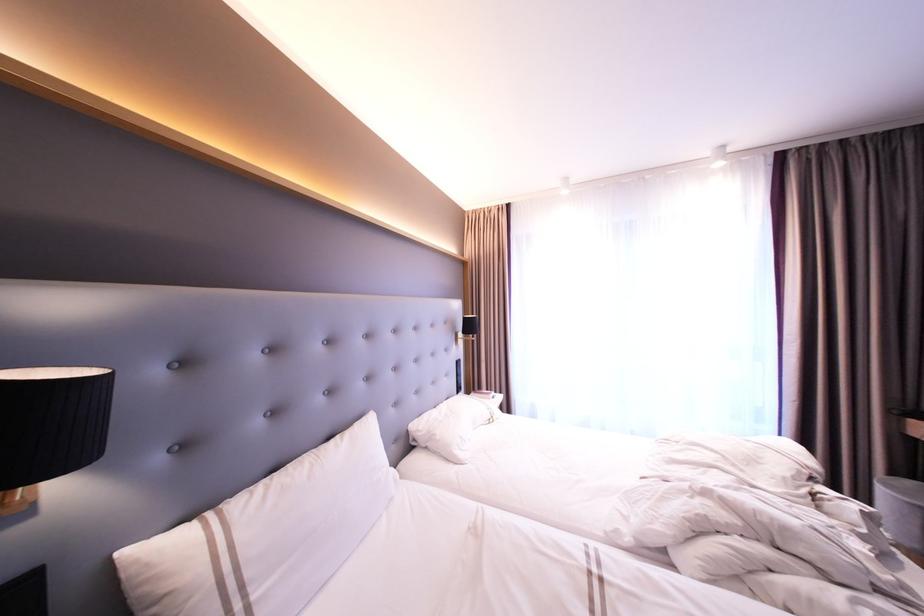
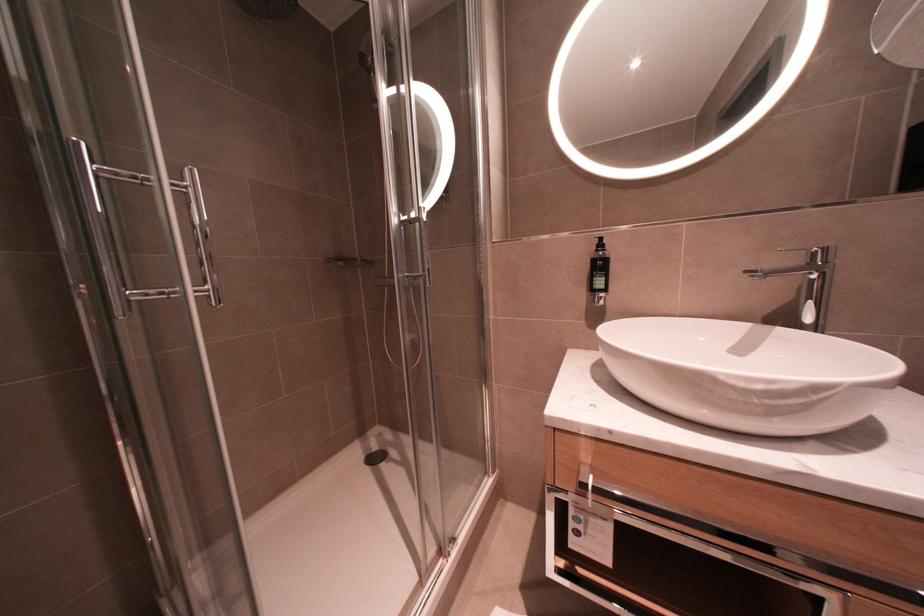
The images are taken continuously from a first-person perspective. In which direction are you moving?

The cameraman walked toward left, backward.